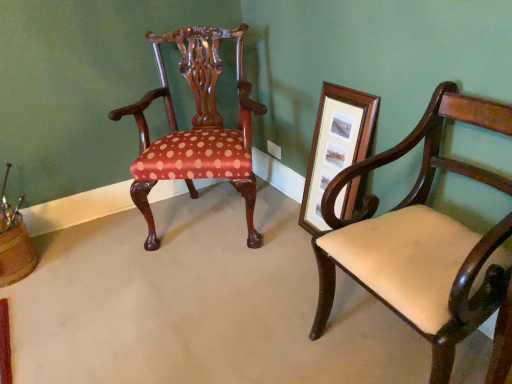
Question: Considering the positions of polished wood chair at center, which is counted as the second chair, starting from the right, and wooden picture frame at right in the image, is polished wood chair at center, which is counted as the second chair, starting from the right, wider or thinner than wooden picture frame at right?

Choices:
 (A) thin
 (B) wide

Answer: (B)

Question: In the image, is polished wood chair at center, which is counted as the 1th chair, starting from the left, positioned in front of or behind wooden picture frame at right?

Choices:
 (A) front
 (B) behind

Answer: (B)

Question: Which object is positioned closest to the polished wood chair at center, which is counted as the second chair, starting from the right?

Choices:
 (A) matte cream upholstered chair at right, which is counted as the second chair, starting from the back
 (B) wooden picture frame at right

Answer: (B)

Question: Which is nearer to the wooden picture frame at right?

Choices:
 (A) matte cream upholstered chair at right, the first chair in the right-to-left sequence
 (B) polished wood chair at center, which is counted as the second chair, starting from the right

Answer: (A)